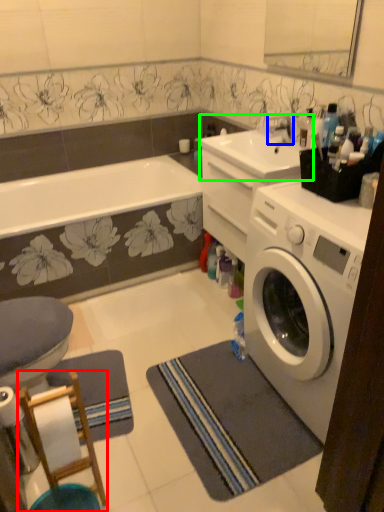
Question: Which object is the closest to the bar stool (highlighted by a red box)? Choose among these: faucet (highlighted by a blue box) or sink (highlighted by a green box).

Choices:
 (A) faucet
 (B) sink

Answer: (B)